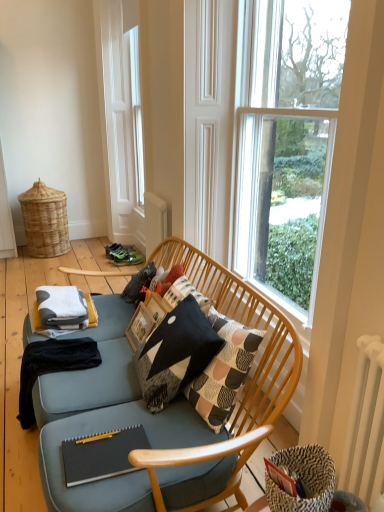
Question: Can you confirm if black matte notebook at lower center is wider than clear glass window at upper right?

Choices:
 (A) yes
 (B) no

Answer: (A)

Question: Considering the relative sizes of black matte notebook at lower center and clear glass window at upper right in the image provided, is black matte notebook at lower center taller than clear glass window at upper right?

Choices:
 (A) yes
 (B) no

Answer: (B)

Question: Are black matte notebook at lower center and clear glass window at upper right located far from each other?

Choices:
 (A) no
 (B) yes

Answer: (B)

Question: Is black matte notebook at lower center positioned with its back to clear glass window at upper right?

Choices:
 (A) no
 (B) yes

Answer: (A)

Question: Can you confirm if black matte notebook at lower center is smaller than clear glass window at upper right?

Choices:
 (A) no
 (B) yes

Answer: (B)

Question: From the image's perspective, is woven natural basket at left positioned above or below black cotton blanket at lower left?

Choices:
 (A) below
 (B) above

Answer: (B)

Question: Is point (29, 214) positioned closer to the camera than point (59, 348)?

Choices:
 (A) farther
 (B) closer

Answer: (A)

Question: Relative to black cotton blanket at lower left, is woven natural basket at left in front or behind?

Choices:
 (A) front
 (B) behind

Answer: (B)

Question: From a real-world perspective, is woven natural basket at left above or below black cotton blanket at lower left?

Choices:
 (A) above
 (B) below

Answer: (A)

Question: In the image, is black matte notebook at lower center on the left side or the right side of black cotton blanket at lower left?

Choices:
 (A) left
 (B) right

Answer: (B)

Question: Is black matte notebook at lower center in front of or behind black cotton blanket at lower left in the image?

Choices:
 (A) behind
 (B) front

Answer: (B)

Question: Is black matte notebook at lower center taller or shorter than black cotton blanket at lower left?

Choices:
 (A) tall
 (B) short

Answer: (B)

Question: Based on their sizes in the image, would you say black matte notebook at lower center is bigger or smaller than black cotton blanket at lower left?

Choices:
 (A) big
 (B) small

Answer: (B)

Question: From the image's perspective, is white metallic radiator at right located above or below clear glass window at upper right?

Choices:
 (A) above
 (B) below

Answer: (B)

Question: From a real-world perspective, relative to clear glass window at upper right, is white metallic radiator at right vertically above or below?

Choices:
 (A) above
 (B) below

Answer: (B)